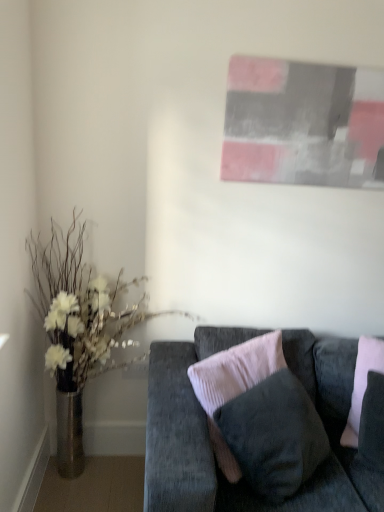
Question: Are velvet dark gray couch at lower right and velvet pink pillow at center beside each other?

Choices:
 (A) yes
 (B) no

Answer: (B)

Question: Is velvet dark gray couch at lower right facing towards velvet pink pillow at center?

Choices:
 (A) yes
 (B) no

Answer: (A)

Question: From the image's perspective, would you say velvet dark gray couch at lower right is positioned over velvet pink pillow at center?

Choices:
 (A) yes
 (B) no

Answer: (B)

Question: Would you say velvet pink pillow at center is part of velvet dark gray couch at lower right's contents?

Choices:
 (A) yes
 (B) no

Answer: (A)

Question: Is velvet dark gray couch at lower right to the right of velvet pink pillow at center from the viewer's perspective?

Choices:
 (A) yes
 (B) no

Answer: (B)

Question: Does velvet dark gray couch at lower right have a lesser height compared to velvet pink pillow at center?

Choices:
 (A) yes
 (B) no

Answer: (B)

Question: Is the surface of metallic vase at left in direct contact with velvet dark gray couch at lower right?

Choices:
 (A) no
 (B) yes

Answer: (A)

Question: Is metallic vase at left at the right side of velvet dark gray couch at lower right?

Choices:
 (A) yes
 (B) no

Answer: (B)

Question: Is metallic vase at left behind velvet dark gray couch at lower right?

Choices:
 (A) no
 (B) yes

Answer: (B)

Question: Is metallic vase at left not within velvet dark gray couch at lower right?

Choices:
 (A) no
 (B) yes

Answer: (B)

Question: Is metallic vase at left in front of velvet dark gray couch at lower right?

Choices:
 (A) yes
 (B) no

Answer: (B)

Question: Does metallic vase at left have a greater height compared to velvet dark gray couch at lower right?

Choices:
 (A) no
 (B) yes

Answer: (B)

Question: From the image's perspective, is metallic vase at left on velvet pink pillow at center?

Choices:
 (A) no
 (B) yes

Answer: (B)